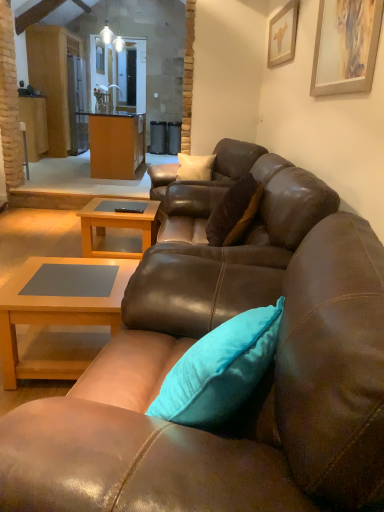
Question: In the image, is brown leather couch at center, acting as the second studio couch starting from the top, positioned in front of or behind matte wood cabinet at center?

Choices:
 (A) behind
 (B) front

Answer: (B)

Question: From a real-world perspective, is brown leather couch at center, which ranks as the 1th studio couch in bottom-to-top order, above or below matte wood cabinet at center?

Choices:
 (A) below
 (B) above

Answer: (A)

Question: Estimate the real-world distances between objects in this image. Which object is farther from the wooden picture frame at upper right, which is the 2th picture frame in front-to-back order?

Choices:
 (A) brown leather couch at center, arranged as the first studio couch when viewed from the top
 (B) brown leather couch at center, acting as the second studio couch starting from the top
 (C) light brown wood coffee table at center, the second coffee table from the front
 (D) wooden picture frame at upper right, placed as the second picture frame when sorted from back to front
 (E) light brown wood coffee table at lower left, arranged as the 2th coffee table when viewed from the back

Answer: (B)

Question: Which object is the farthest from the light brown wood coffee table at lower left, which ranks as the 2th coffee table in top-to-bottom order?

Choices:
 (A) matte wood cabinet at center
 (B) brown leather swivel chair at center
 (C) brown leather couch at center, the second studio couch viewed from the front
 (D) wooden picture frame at upper right, acting as the second picture frame starting from the top
 (E) light brown wood coffee table at center, which is counted as the 1th coffee table, starting from the top

Answer: (A)